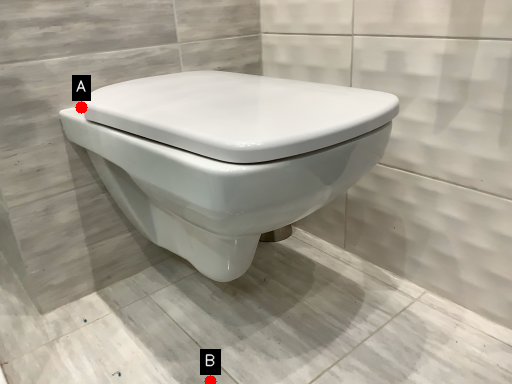
Question: Two points are circled on the image, labeled by A and B beside each circle. Which point is closer to the camera?

Choices:
 (A) A is closer
 (B) B is closer

Answer: (B)